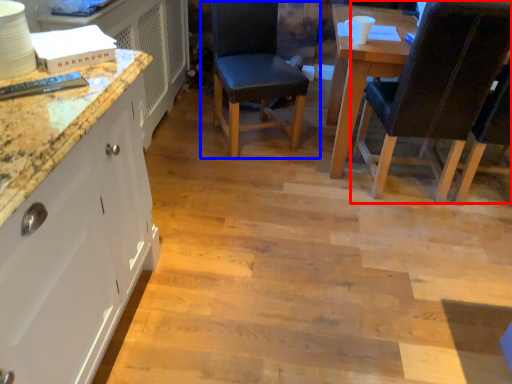
Question: Which object appears farthest to the camera in this image, chair (highlighted by a red box) or chair (highlighted by a blue box)?

Choices:
 (A) chair
 (B) chair

Answer: (B)